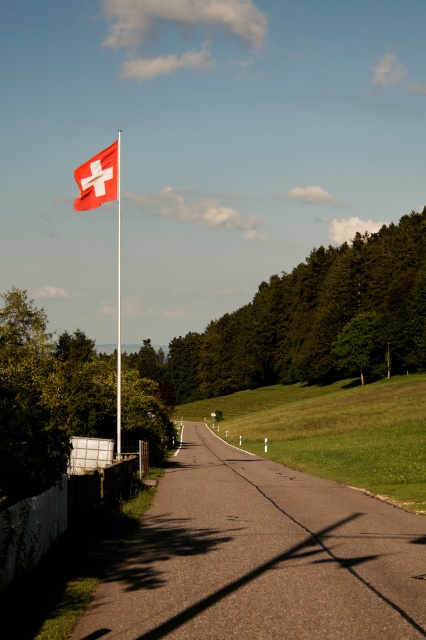
In the scene shown: You are a hiker planning to take a photo of the red fabric flag at upper left and the asphalt road at center from a vantage point that allows both to be in the frame. Based on their positions, which object should you place closer to the left edge of your camera viewfinder to include both in the shot?

The red fabric flag at upper left should be placed closer to the left edge of the camera viewfinder because the asphalt road at center is positioned to its right, so positioning the flag on the left allows both objects to be captured within the frame.

You are a photographer standing at the end of the road in the image. You want to capture a photo that includes both the red fabric flag at upper left and the red plastic flag pole at upper left. Based on their positions, which one should you adjust your camera to focus on first to ensure both are in the frame?

The red fabric flag at upper left is to the left of the red plastic flag pole at upper left. To include both in the frame, focus on the red fabric flag at upper left first as it is positioned further to the left, ensuring the entire area between them is captured.